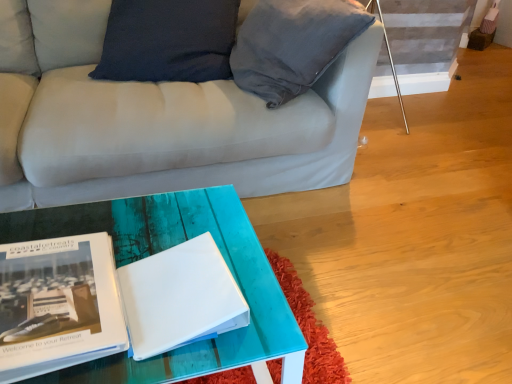
Question: In terms of size, does matte black book at lower left appear bigger or smaller than white matte book at center?

Choices:
 (A) big
 (B) small

Answer: (A)

Question: From the image's perspective, is matte black book at lower left located above or below white matte book at center?

Choices:
 (A) below
 (B) above

Answer: (A)

Question: Does point (29, 336) appear closer or farther from the camera than point (119, 288)?

Choices:
 (A) closer
 (B) farther

Answer: (A)

Question: Is white matte book at center spatially inside matte black book at lower left, or outside of it?

Choices:
 (A) outside
 (B) inside

Answer: (A)

Question: Considering the positions of white matte book at center and matte black book at lower left in the image, is white matte book at center bigger or smaller than matte black book at lower left?

Choices:
 (A) big
 (B) small

Answer: (B)

Question: From a real-world perspective, relative to matte black book at lower left, is white matte book at center vertically above or below?

Choices:
 (A) above
 (B) below

Answer: (A)

Question: From the image's perspective, is white matte book at center positioned above or below matte black book at lower left?

Choices:
 (A) below
 (B) above

Answer: (B)